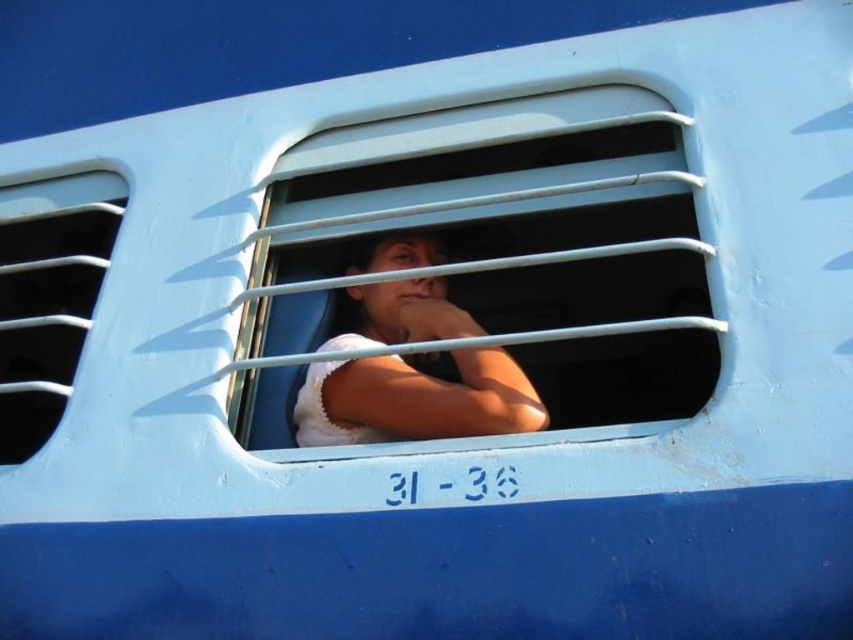
Question: Is white metal window at center positioned behind white plastic vent at left?

Choices:
 (A) yes
 (B) no

Answer: (B)

Question: Which point is farther to the camera?

Choices:
 (A) (373, 250)
 (B) (636, 205)
 (C) (62, 406)

Answer: (A)

Question: Which point is closer to the camera?

Choices:
 (A) white matte shirt at center
 (B) white plastic vent at left

Answer: (A)

Question: Can you confirm if white metal window at center is wider than white matte shirt at center?

Choices:
 (A) no
 (B) yes

Answer: (B)

Question: Can you confirm if white metal window at center is positioned above white matte shirt at center?

Choices:
 (A) no
 (B) yes

Answer: (B)

Question: Which point is closer to the camera?

Choices:
 (A) white matte shirt at center
 (B) white plastic vent at left
 (C) white metal window at center

Answer: (C)